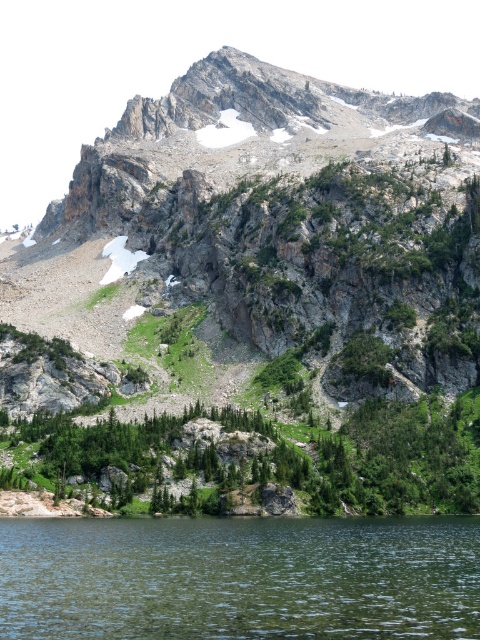
Consider the image. Does rocky gray mountain at upper center have a greater height compared to clear water at lower center?

Yes, rocky gray mountain at upper center is taller than clear water at lower center.

You are a GUI agent. You are given a task and a screenshot of the screen. Output one action in this format:
    pyautogui.click(x=<x>, y=<y>)
    Task: Click on the rocky gray mountain at upper center
    
    Given the screenshot: What is the action you would take?
    pyautogui.click(x=259, y=296)